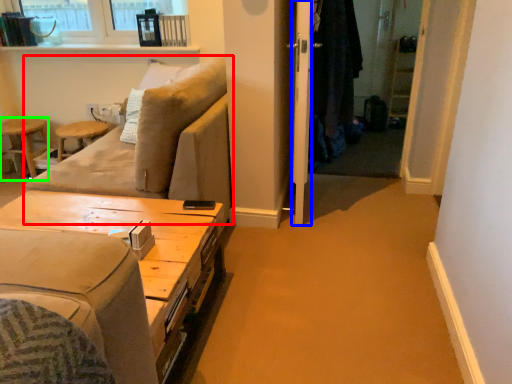
Question: Which object is positioned farthest from studio couch (highlighted by a red box)? Select from screen door (highlighted by a blue box) and bar stool (highlighted by a green box).

Choices:
 (A) screen door
 (B) bar stool

Answer: (B)